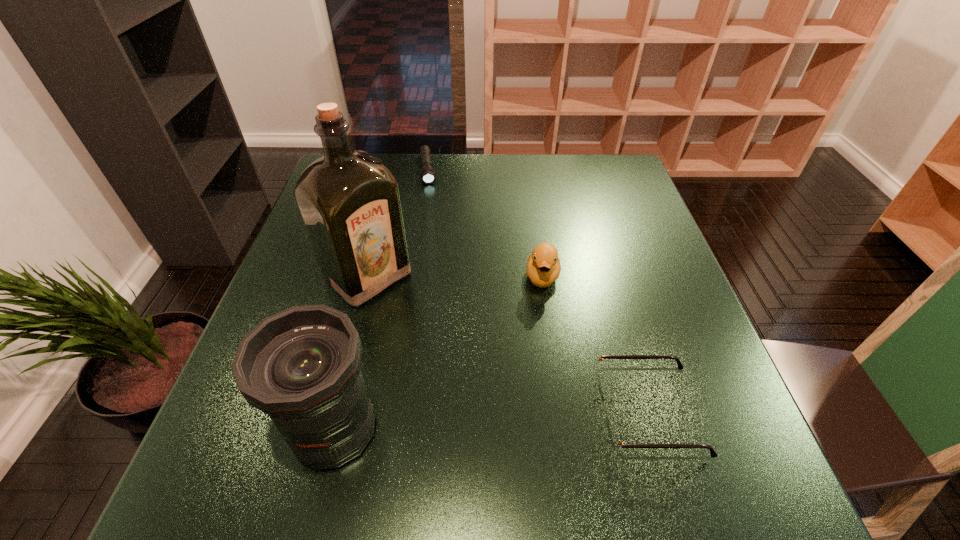
Where is `free space between the fourth tallest object and the shortest object`? free space between the fourth tallest object and the shortest object is located at coordinates (538, 291).

Select which object appears as the closest to the liquor. Please provide its 2D coordinates. Your answer should be formatted as a tuple, i.e. [(x, y)], where the tuple contains the x and y coordinates of a point satisfying the conditions above.

[(301, 366)]

Where is `object that can be found as the fourth closest to the flashlight`? The image size is (960, 540). object that can be found as the fourth closest to the flashlight is located at coordinates (616, 444).

Image resolution: width=960 pixels, height=540 pixels. What are the coordinates of `free region that satisfies the following two spatial constraints: 1. on the back side of the telephoto lens; 2. on the right side of the fourth object from left to right` in the screenshot? It's located at (372, 276).

Image resolution: width=960 pixels, height=540 pixels. What are the coordinates of `vacant space that satisfies the following two spatial constraints: 1. on the back side of the second tallest object; 2. on the left side of the flashlight` in the screenshot? It's located at (398, 170).

You are a GUI agent. You are given a task and a screenshot of the screen. Output one action in this format:
    pyautogui.click(x=<x>, y=<y>)
    Task: Click on the vacant space that satisfies the following two spatial constraints: 1. on the back side of the third shortest object; 2. on the right side of the fourth shortest object
    
    Given the screenshot: What is the action you would take?
    pyautogui.click(x=372, y=276)

Locate an element on the screen. The height and width of the screenshot is (540, 960). vacant space that satisfies the following two spatial constraints: 1. on the front side of the liquor; 2. at the hinge ends of the fourth tallest object is located at coordinates (333, 413).

This screenshot has height=540, width=960. Find the location of `vacant space that satisfies the following two spatial constraints: 1. on the back side of the spectacles; 2. at the hinge ends of the telephoto lens`. vacant space that satisfies the following two spatial constraints: 1. on the back side of the spectacles; 2. at the hinge ends of the telephoto lens is located at coordinates (339, 413).

In order to click on free space that satisfies the following two spatial constraints: 1. on the front side of the fourth object from left to right; 2. on the right side of the tallest object in this screenshot , I will do `click(368, 276)`.